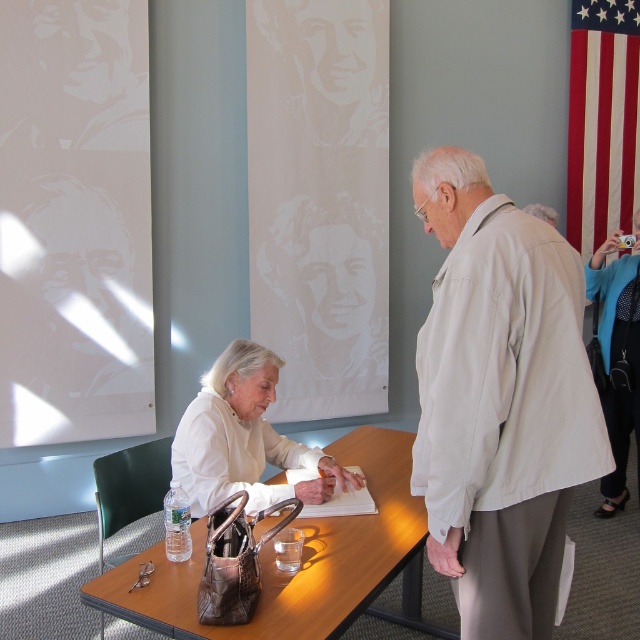
Question: Which of the following is the farthest from the observer?

Choices:
 (A) (584, 58)
 (B) (308, 518)
 (C) (449, 552)

Answer: (A)

Question: Does beige cotton shirt at right appear over red fabric flag at upper right?

Choices:
 (A) yes
 (B) no

Answer: (B)

Question: Which of the following is the closest to the observer?

Choices:
 (A) (260, 371)
 (B) (513, 330)
 (C) (620, 113)

Answer: (B)

Question: Estimate the real-world distances between objects in this image. Which object is farther from the white matte shirt at center?

Choices:
 (A) red fabric flag at upper right
 (B) light beige shirt at center

Answer: (A)

Question: Can you confirm if red fabric flag at upper right is thinner than white matte shirt at center?

Choices:
 (A) no
 (B) yes

Answer: (B)

Question: Does beige cotton shirt at right have a smaller size compared to red fabric flag at upper right?

Choices:
 (A) no
 (B) yes

Answer: (B)